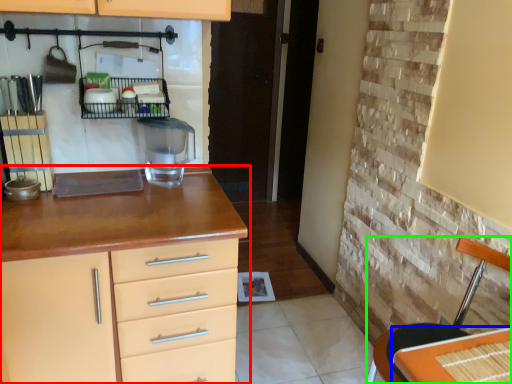
Question: Based on their relative distances, which object is nearer to chest of drawers (highlighted by a red box)? Choose from table (highlighted by a blue box) and chair (highlighted by a green box).

Choices:
 (A) table
 (B) chair

Answer: (B)